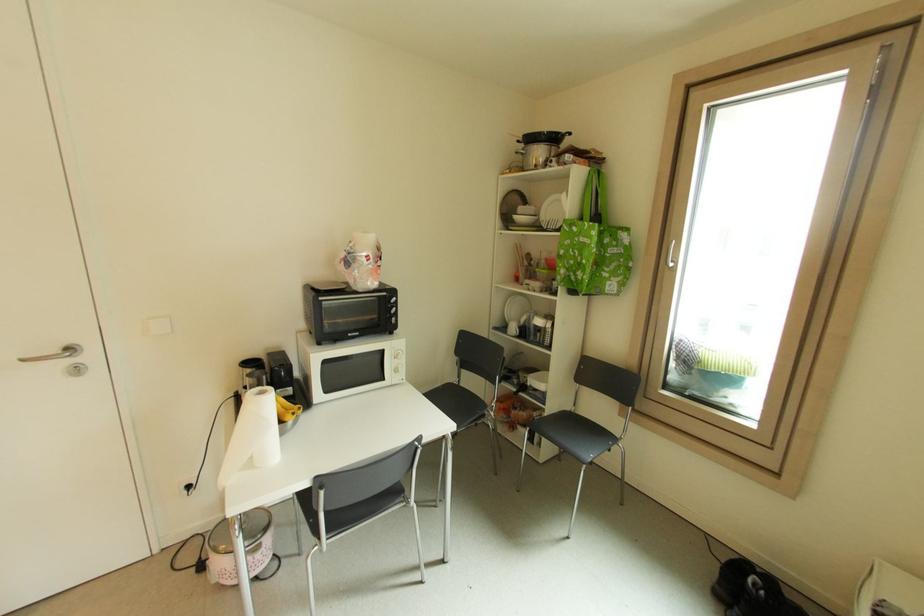
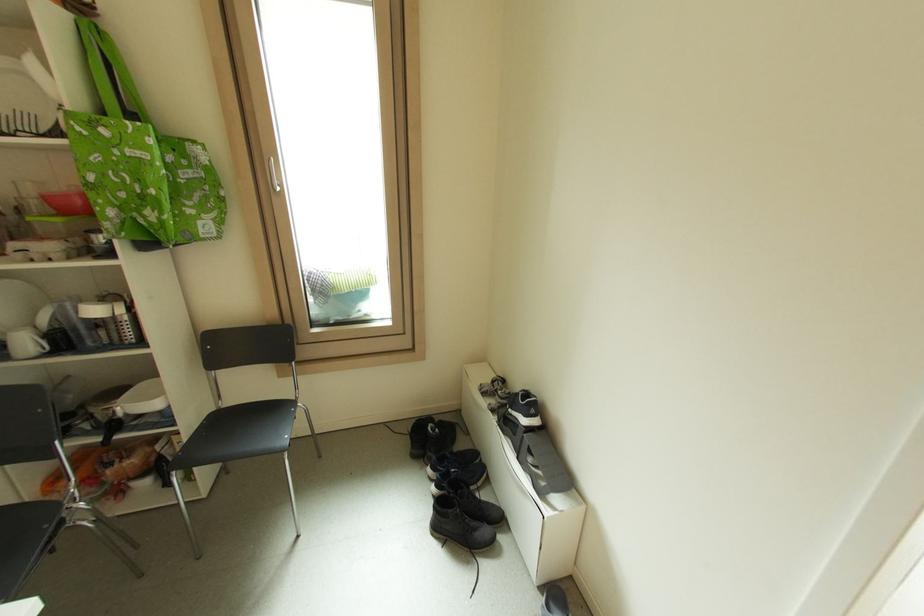
Find the pixel in the second image that matches pixel 518 329 in the first image.

(31, 344)